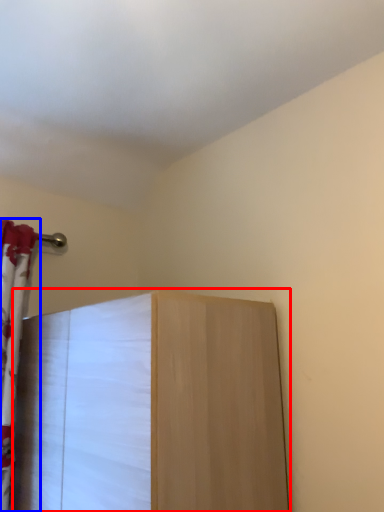
Question: Among these objects, which one is nearest to the camera, furniture (highlighted by a red box) or curtain (highlighted by a blue box)?

Choices:
 (A) furniture
 (B) curtain

Answer: (A)